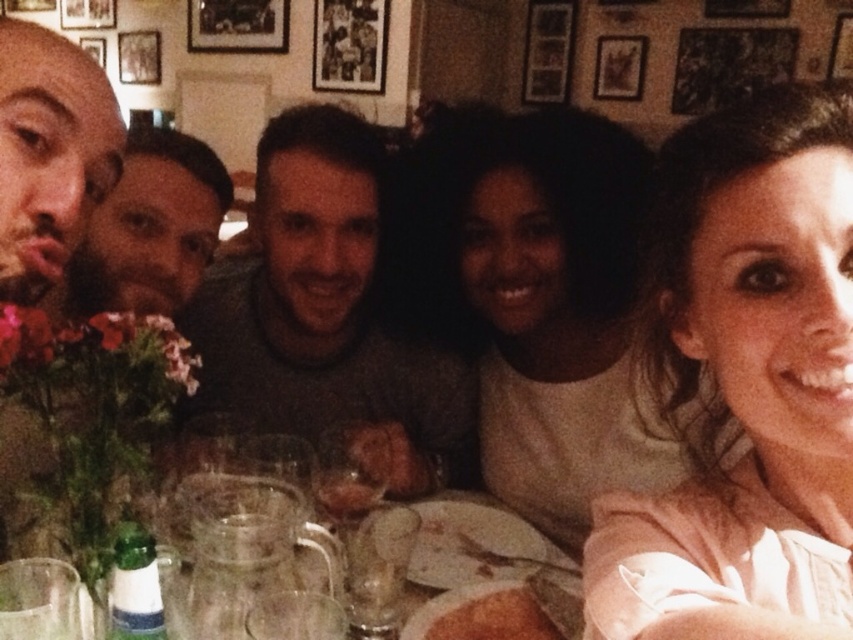
You are standing in the room where the group is seated. If you face the dining table and look towards the bald head at left, in which direction should you turn to look at the wall with framed photographs?

The bald head at left is positioned at point (49, 154). Since the wall with framed photographs is in the background behind the table, you would need to turn around to face the wall with framed photographs.

You are a photographer taking a picture of the dining table. You notice the bald head at left and the clear glass plates at center. Which object is closer to the camera?

The bald head at left is closer to the camera because it is in front of the clear glass plates at center.